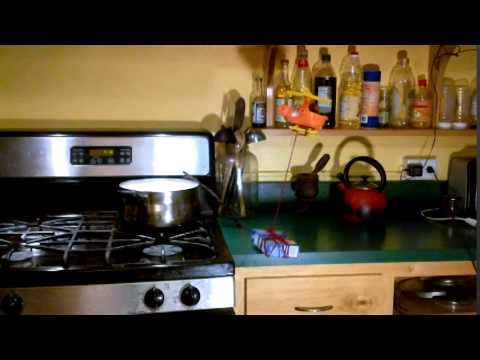
I want to click on stove knobs, so click(x=12, y=302), click(x=153, y=299), click(x=193, y=295).